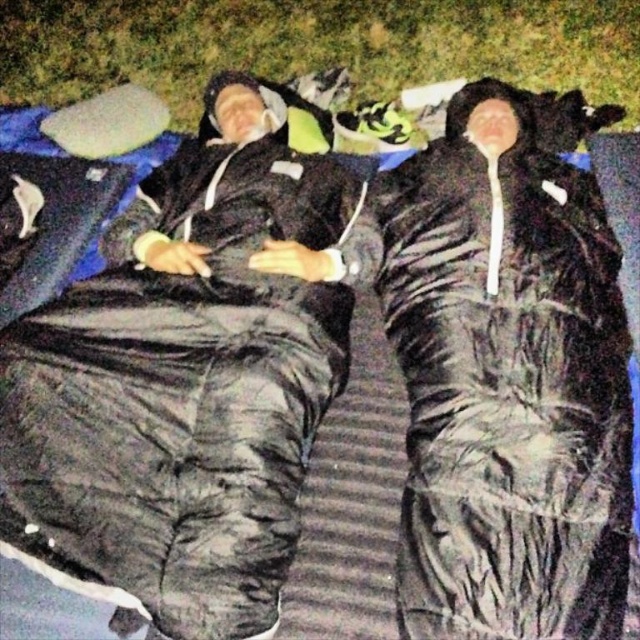
Question: From the image, what is the correct spatial relationship of black matte sleeping bag at center in relation to green grass at upper center?

Choices:
 (A) left
 (B) right

Answer: (A)

Question: Which object is farther from the camera taking this photo?

Choices:
 (A) green grass at upper center
 (B) black matte sleeping bag at center

Answer: (A)

Question: Which of the following is the closest to the observer?

Choices:
 (A) green grass at upper center
 (B) black matte sleeping bag at center

Answer: (B)

Question: Is black matte sleeping bag at center to the right of green grass at upper center from the viewer's perspective?

Choices:
 (A) yes
 (B) no

Answer: (B)

Question: Is black matte sleeping bag at center closer to camera compared to green grass at upper center?

Choices:
 (A) yes
 (B) no

Answer: (A)